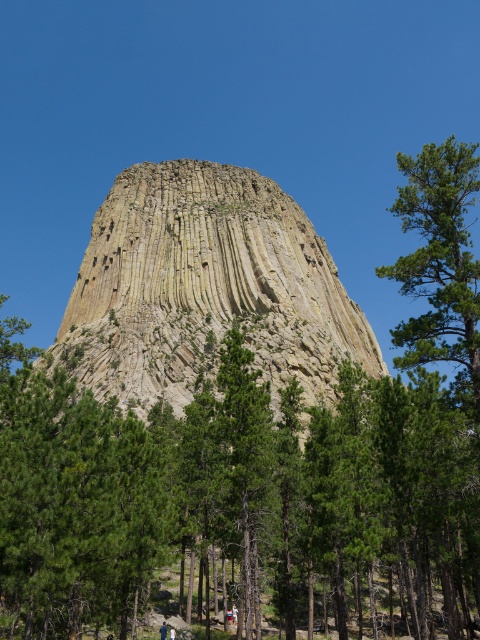
Measure the distance from green leafy tree at center to yellowish rock formation at center.

green leafy tree at center is 25.03 meters from yellowish rock formation at center.

Is the position of green leafy tree at center less distant than that of yellowish rock formation at center?

Yes, it is in front of yellowish rock formation at center.

Between point (431, 618) and point (134, 352), which one is positioned behind?

Point (134, 352)

Where is `green leafy tree at center`? Image resolution: width=480 pixels, height=640 pixels. green leafy tree at center is located at coordinates (238, 502).

Which is more to the left, green textured tree at right or light brown wooden stick at lower center?

light brown wooden stick at lower center

Which is behind, point (437, 340) or point (163, 634)?

Positioned behind is point (163, 634).

What are the coordinates of `green textured tree at right` in the screenshot? It's located at (440, 260).

The width and height of the screenshot is (480, 640). Identify the location of green textured tree at right. (440, 260).

What do you see at coordinates (205, 289) in the screenshot?
I see `yellowish rock formation at center` at bounding box center [205, 289].

Which is more to the right, yellowish rock formation at center or green textured tree at right?

Positioned to the right is green textured tree at right.

Where is `yellowish rock formation at center`? The height and width of the screenshot is (640, 480). yellowish rock formation at center is located at coordinates (205, 289).